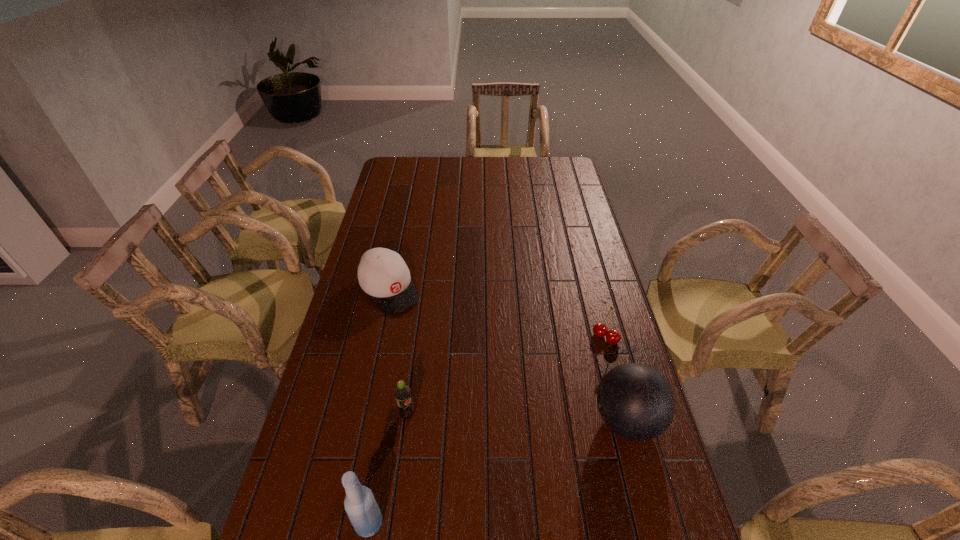
Locate an element on the screen. This screenshot has width=960, height=540. free space on the desktop that is between the tallest object and the fourth shortest object and is positioned on the front-facing side of the baseball cap is located at coordinates (525, 461).

Find the location of a particular element. vacant space on the desktop that is between the nearest object and the fourth shortest object and is positioned with the stems of the cherry pointing upwards is located at coordinates (513, 466).

Find the location of a particular element. This screenshot has width=960, height=540. vacant space on the desktop that is between the nearest object and the bowling ball and is positioned on the front label of the soda is located at coordinates coord(482,478).